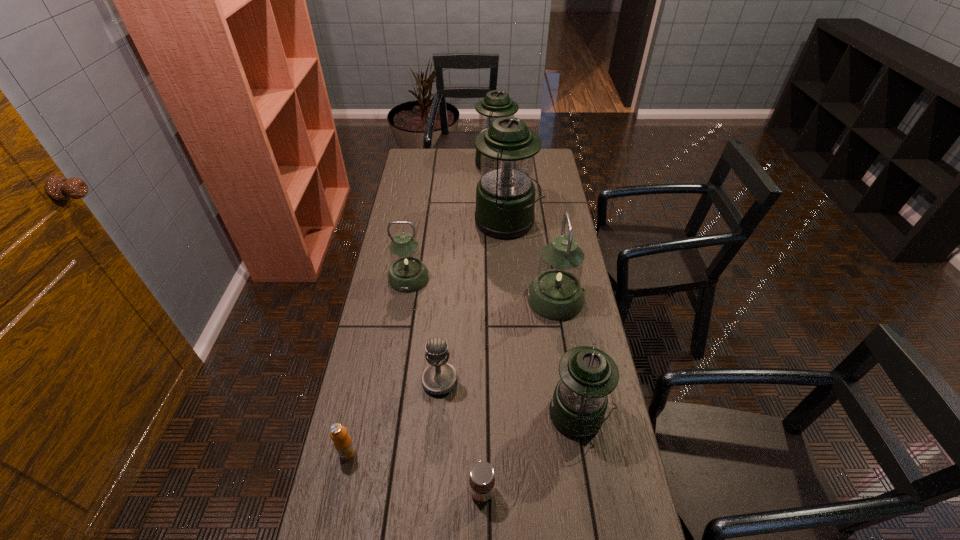
Locate an element on the screen. free location located on the front-facing side of the sixth tallest object is located at coordinates (432, 489).

Identify the location of vacant space located on the front label of the second nearest object. (341, 484).

I want to click on vacant space located on the label side of the nearest object, so click(x=403, y=491).

Where is `blank space located on the label side of the nearest object`? blank space located on the label side of the nearest object is located at coordinates (383, 491).

At what (x,y) coordinates should I click in order to perform the action: click on vacant point located 0.160m on the label side of the nearest object. Please return your answer as a coordinate pair (x, y). Looking at the image, I should click on (407, 491).

Locate an element on the screen. This screenshot has height=540, width=960. object that is at the far edge is located at coordinates (496, 104).

Where is `lantern at the left edge`? The height and width of the screenshot is (540, 960). lantern at the left edge is located at coordinates (407, 274).

Identify the location of orange juice that is at the left edge. This screenshot has height=540, width=960. (343, 443).

I want to click on vacant space at the far edge of the desktop, so click(x=476, y=167).

Locate an element on the screen. The height and width of the screenshot is (540, 960). vacant space at the left edge of the desktop is located at coordinates (382, 339).